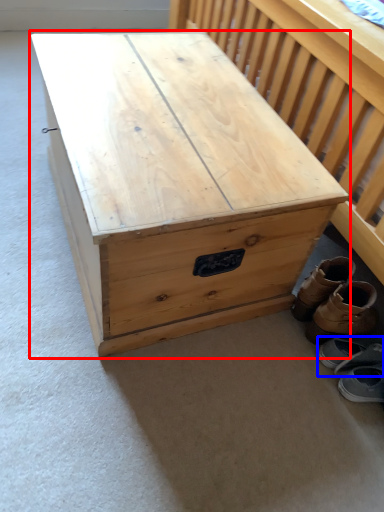
Question: Among these objects, which one is nearest to the camera, table (highlighted by a red box) or footwear (highlighted by a blue box)?

Choices:
 (A) table
 (B) footwear

Answer: (A)